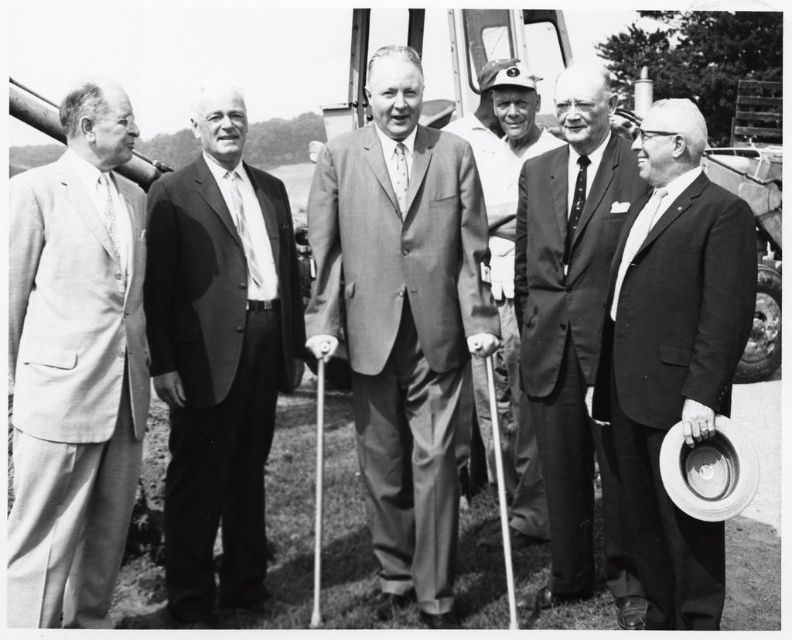
Question: Which object is the farthest from the white silk tie at center?

Choices:
 (A) smooth black suit at right
 (B) smooth suit at center
 (C) light gray suit at left
 (D) smooth gray suit at center

Answer: (C)

Question: Does smooth suit at center have a larger size compared to smooth black suit at right?

Choices:
 (A) yes
 (B) no

Answer: (A)

Question: Considering the relative positions of smooth black suit at right and matte black tie at center in the image provided, where is smooth black suit at right located with respect to matte black tie at center?

Choices:
 (A) left
 (B) right

Answer: (B)

Question: Which point is farther to the camera?

Choices:
 (A) smooth white shirt at center
 (B) white silk tie at center
 (C) matte black tie at center

Answer: (A)

Question: Is smooth black suit at right below smooth white shirt at center?

Choices:
 (A) no
 (B) yes

Answer: (B)

Question: Which object is closer to the camera taking this photo?

Choices:
 (A) smooth gray suit at center
 (B) matte black tie at center

Answer: (A)